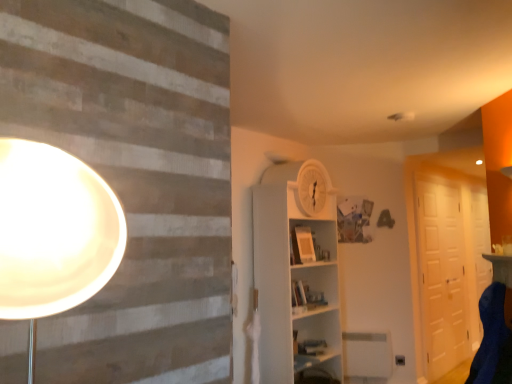
Question: Considering the relative sizes of blue fabric swivel chair at lower right and matte white table at right in the image provided, is blue fabric swivel chair at lower right thinner than matte white table at right?

Choices:
 (A) yes
 (B) no

Answer: (B)

Question: Can you confirm if blue fabric swivel chair at lower right is taller than matte white table at right?

Choices:
 (A) yes
 (B) no

Answer: (A)

Question: Does blue fabric swivel chair at lower right have a greater width compared to matte white table at right?

Choices:
 (A) no
 (B) yes

Answer: (B)

Question: Can you confirm if blue fabric swivel chair at lower right is bigger than matte white table at right?

Choices:
 (A) yes
 (B) no

Answer: (A)

Question: Considering the relative positions of blue fabric swivel chair at lower right and matte white table at right in the image provided, is blue fabric swivel chair at lower right in front of matte white table at right?

Choices:
 (A) no
 (B) yes

Answer: (B)

Question: Considering the relative sizes of blue fabric swivel chair at lower right and matte white table at right in the image provided, is blue fabric swivel chair at lower right smaller than matte white table at right?

Choices:
 (A) no
 (B) yes

Answer: (A)

Question: Is matte white table at right directly adjacent to white glossy door at right?

Choices:
 (A) yes
 (B) no

Answer: (B)

Question: Considering the relative sizes of matte white table at right and white glossy door at right in the image provided, is matte white table at right taller than white glossy door at right?

Choices:
 (A) yes
 (B) no

Answer: (B)

Question: Could you tell me if matte white table at right is turned towards white glossy door at right?

Choices:
 (A) yes
 (B) no

Answer: (B)

Question: Is matte white table at right far from white glossy door at right?

Choices:
 (A) yes
 (B) no

Answer: (A)

Question: Is the depth of matte white table at right greater than that of white glossy door at right?

Choices:
 (A) yes
 (B) no

Answer: (B)

Question: From the image's perspective, is matte white table at right located above white glossy door at right?

Choices:
 (A) yes
 (B) no

Answer: (A)

Question: Can you confirm if white matte barn door at right is bigger than white glossy door at right?

Choices:
 (A) no
 (B) yes

Answer: (B)